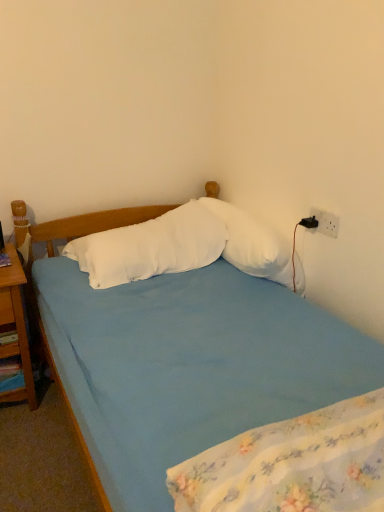
Question: Considering the positions of blue fabric mattress at lower center and black plastic power outlet at upper right in the image, is blue fabric mattress at lower center taller or shorter than black plastic power outlet at upper right?

Choices:
 (A) short
 (B) tall

Answer: (B)

Question: From a real-world perspective, is blue fabric mattress at lower center above or below black plastic power outlet at upper right?

Choices:
 (A) above
 (B) below

Answer: (B)

Question: Estimate the real-world distances between objects in this image. Which object is farther from the white soft pillow at center, the first pillow in the right-to-left sequence?

Choices:
 (A) wooden nightstand at left
 (B) blue fabric bed at center
 (C) black plastic power outlet at upper right
 (D) blue fabric mattress at lower center
 (E) white soft pillow at center, arranged as the 2th pillow when viewed from the right

Answer: (D)

Question: Which is nearer to the black plastic power outlet at upper right?

Choices:
 (A) white soft pillow at center, the first pillow in the right-to-left sequence
 (B) white soft pillow at center, arranged as the 2th pillow when viewed from the right
 (C) wooden nightstand at left
 (D) blue fabric bed at center
 (E) blue fabric mattress at lower center

Answer: (A)